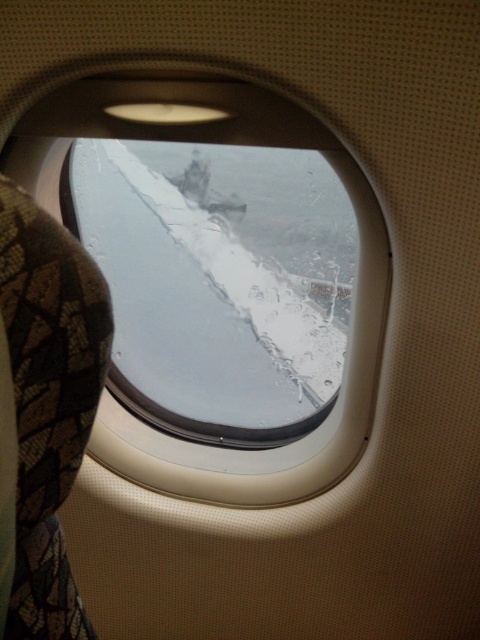
Is white frosted glass at center bigger than transparent glass airplane window at center?

No.

Who is more distant from viewer, (x=212, y=257) or (x=262, y=500)?

The point (x=212, y=257) is more distant.

Is point (158, 388) positioned behind point (230, 113)?

That is True.

Where is `white frosted glass at center`? Image resolution: width=480 pixels, height=640 pixels. white frosted glass at center is located at coordinates (218, 272).